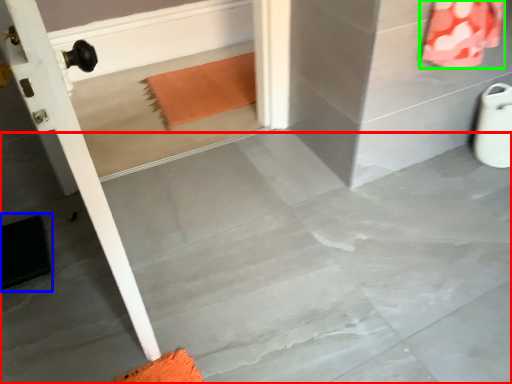
Question: Based on their relative distances, which object is nearer to concrete (highlighted by a red box)? Choose from doormat (highlighted by a blue box) and material (highlighted by a green box).

Choices:
 (A) doormat
 (B) material

Answer: (A)